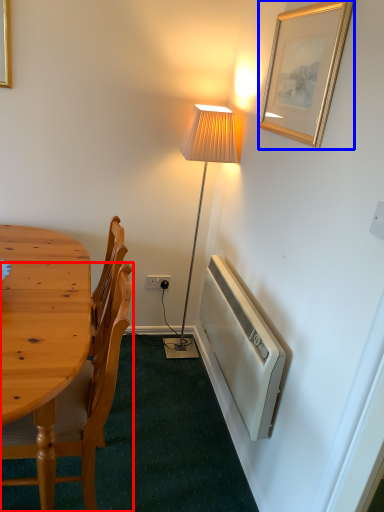
Question: Which object is closer to the camera taking this photo, chair (highlighted by a red box) or picture frame (highlighted by a blue box)?

Choices:
 (A) chair
 (B) picture frame

Answer: (A)